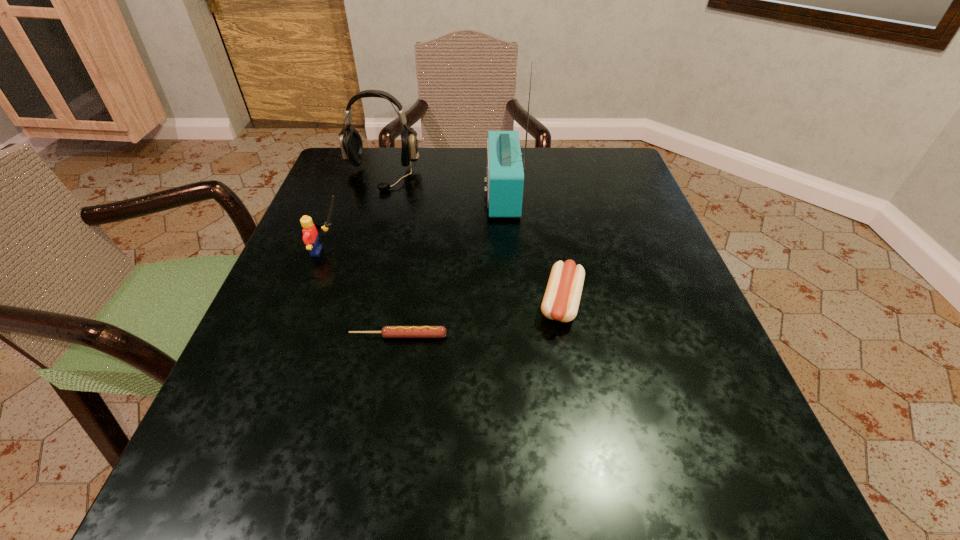
This screenshot has height=540, width=960. I want to click on the second object from right to left, so click(x=505, y=176).

Locate an element on the screen. This screenshot has width=960, height=540. the tallest object is located at coordinates (505, 176).

Where is `the second tallest object`? the second tallest object is located at coordinates (351, 145).

The width and height of the screenshot is (960, 540). Find the location of `Lego`. Lego is located at coordinates (310, 237).

Image resolution: width=960 pixels, height=540 pixels. I want to click on the third shortest object, so click(310, 237).

Identify the location of the right sausage. The image size is (960, 540). click(561, 300).

This screenshot has height=540, width=960. In order to click on the taller sausage in this screenshot , I will do `click(561, 300)`.

Identify the location of the left sausage. The width and height of the screenshot is (960, 540). (387, 331).

Identify the location of the shortest object. The height and width of the screenshot is (540, 960). (387, 331).

This screenshot has height=540, width=960. Find the location of `free region located 0.330m on the front panel of the tallest object`. free region located 0.330m on the front panel of the tallest object is located at coordinates (338, 194).